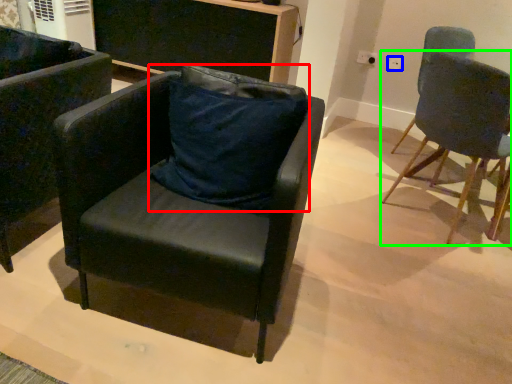
Question: Based on their relative distances, which object is nearer to pillow (highlighted by a red box)? Choose from power outlet (highlighted by a blue box) and chair (highlighted by a green box).

Choices:
 (A) power outlet
 (B) chair

Answer: (B)